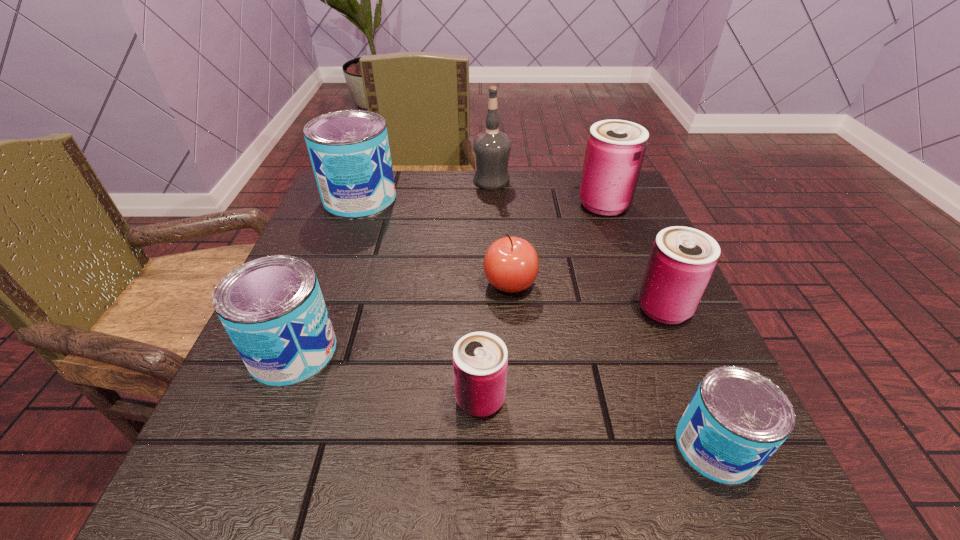
This screenshot has height=540, width=960. In order to click on vacant point that satisfies the following two spatial constraints: 1. on the front side of the second farthest pink can; 2. on the left side of the farthest blue can in this screenshot , I will do `click(319, 308)`.

Locate an element on the screen. The image size is (960, 540). vacant position in the image that satisfies the following two spatial constraints: 1. on the front label of the vodka; 2. on the right side of the apple is located at coordinates (495, 284).

You are a GUI agent. You are given a task and a screenshot of the screen. Output one action in this format:
    pyautogui.click(x=<x>, y=<y>)
    Task: Click on the vacant space that satisfies the following two spatial constraints: 1. on the front label of the tallest object; 2. on the front side of the farthest blue can
    The image size is (960, 540).
    Given the screenshot: What is the action you would take?
    pyautogui.click(x=492, y=199)